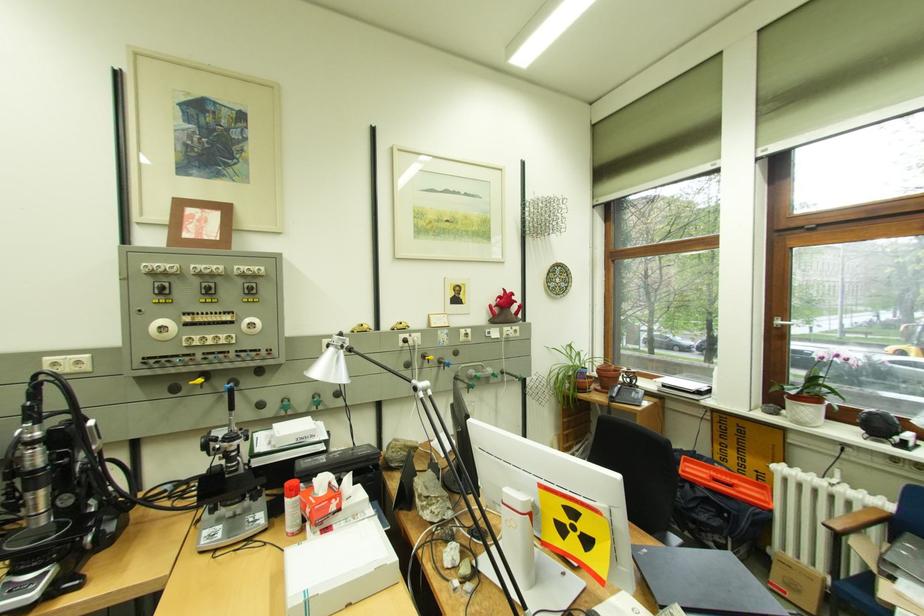
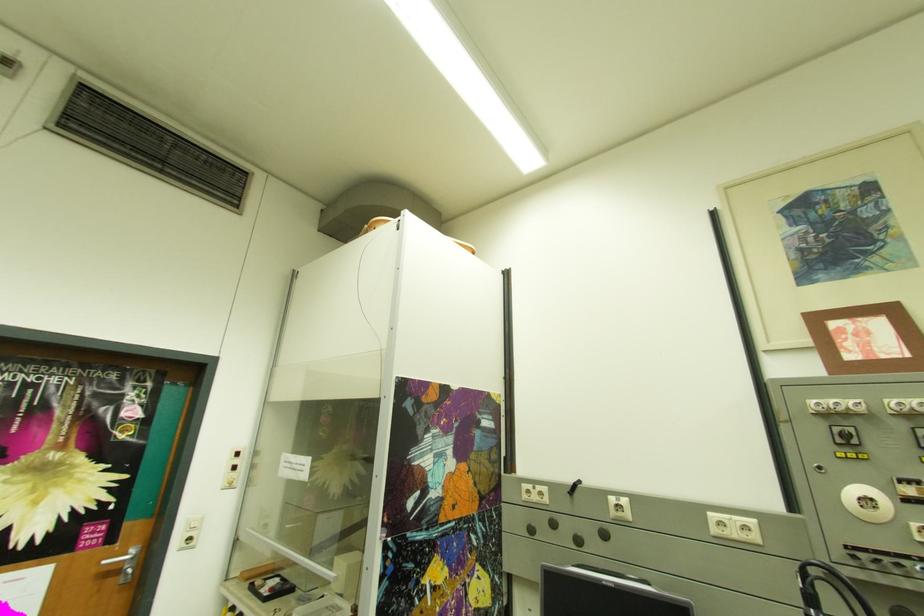
Find the pixel in the second image that matches [174,292] in the first image.

(857, 440)